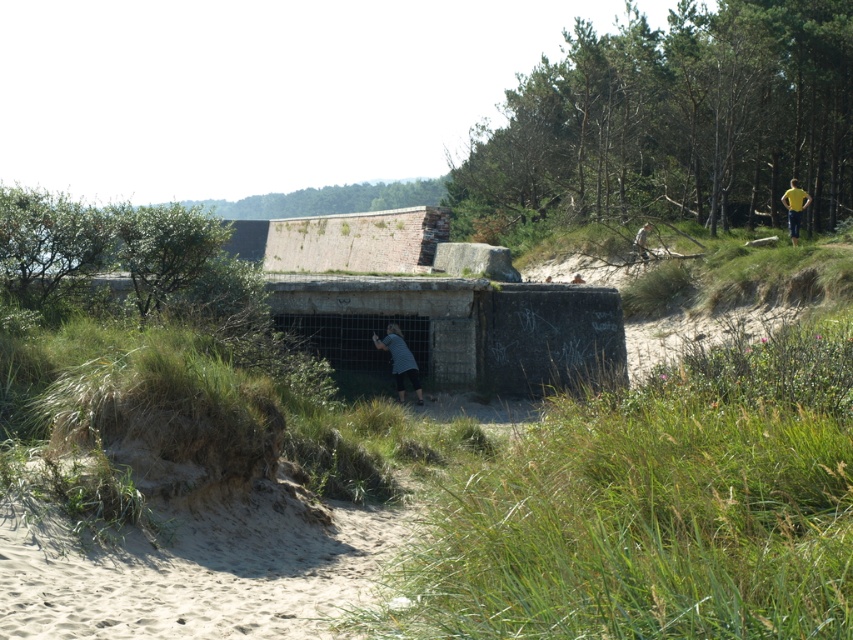
You are a hiker who wants to identify the highest point in the image where a yellow shirt is visible. Which object between the yellow fabric shirt at upper right and the yellow shirt at upper right is higher?

The yellow fabric shirt at upper right is higher than the yellow shirt at upper right, so the highest point is the yellow fabric shirt at upper right.

You are a photographer trying to capture both the gray striped shirt at center and the yellow shirt at upper right in the same frame. Based on their heights, which one should you focus on to ensure both are visible without adjusting your camera angle?

Since the gray striped shirt at center is much taller than the yellow shirt at upper right, you should focus on the gray striped shirt at center to ensure both are visible in the frame without adjusting your camera angle.

You are a hiker who wants to take a photo of the gray striped shirt at center and the yellow fabric shirt at upper right. Which shirt should you zoom in more on to capture both shirts clearly in the frame?

Since the gray striped shirt at center is thinner than the yellow fabric shirt at upper right, you should zoom in more on the gray striped shirt at center to ensure both are captured clearly.